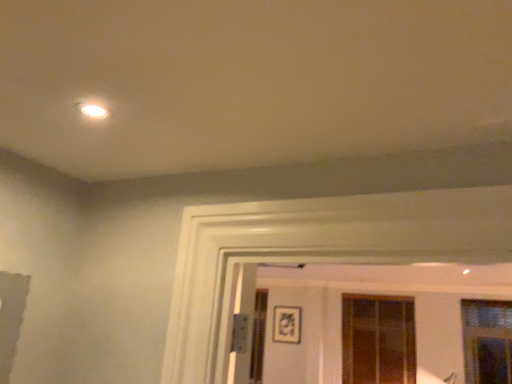
Question: From the image's perspective, is matte black picture frame at center above or below translucent glass window at center, arranged as the first window when viewed from the back?

Choices:
 (A) below
 (B) above

Answer: (B)

Question: Is matte black picture frame at center inside or outside of translucent glass window at center, acting as the 2th window starting from the right?

Choices:
 (A) inside
 (B) outside

Answer: (B)

Question: Considering the real-world distances, which object is closest to the clear glass window at right, the 2th window from the left?

Choices:
 (A) matte black picture frame at center
 (B) translucent glass window at center, acting as the 2th window starting from the right

Answer: (B)

Question: Based on their relative distances, which object is farther from the translucent glass window at center, acting as the 2th window starting from the right?

Choices:
 (A) matte black picture frame at center
 (B) clear glass window at right, the 2th window from the left

Answer: (A)